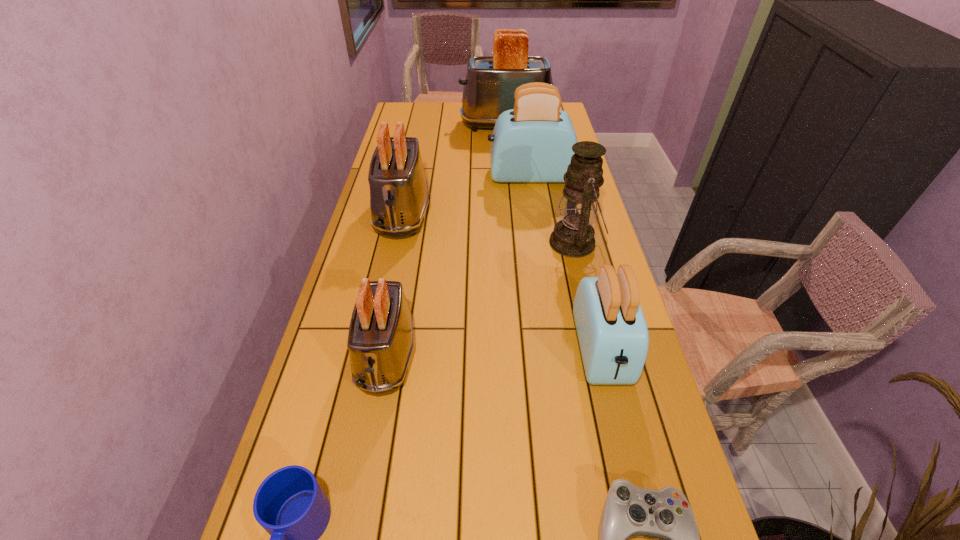
At what (x,y) coordinates should I click in order to perform the action: click on free space located on the front of the green oil lamp. Please return your answer as a coordinate pair (x, y). This screenshot has width=960, height=540. Looking at the image, I should click on (590, 306).

What are the coordinates of `free space located 0.180m on the side of the farther light toaster with the lever` in the screenshot? It's located at (440, 176).

Where is `vacant space located 0.300m on the side of the farther light toaster with the lever`? vacant space located 0.300m on the side of the farther light toaster with the lever is located at coordinates click(x=408, y=176).

Identify the location of free space located 0.330m on the side of the farther light toaster with the lever. (400, 176).

Image resolution: width=960 pixels, height=540 pixels. I want to click on vacant region located on the side of the second biggest gray toaster with the control lever, so click(x=384, y=301).

What are the coordinates of `vacant space located 0.220m on the side of the nearer light toaster with the lever` in the screenshot? It's located at (636, 495).

Identify the location of free region located 0.200m on the side of the nearest gray toaster with the control lever. (361, 496).

This screenshot has height=540, width=960. Identify the location of object that is at the far edge. 491,81.

You are a GUI agent. You are given a task and a screenshot of the screen. Output one action in this format:
    pyautogui.click(x=<x>, y=<y>)
    Task: Click on the oil lamp present at the right edge
    The width and height of the screenshot is (960, 540).
    Given the screenshot: What is the action you would take?
    pyautogui.click(x=573, y=236)

You are a GUI agent. You are given a task and a screenshot of the screen. Output one action in this format:
    pyautogui.click(x=<x>, y=<y>)
    Task: Click on the object positioned at the far right corner
    
    Given the screenshot: What is the action you would take?
    pyautogui.click(x=491, y=81)